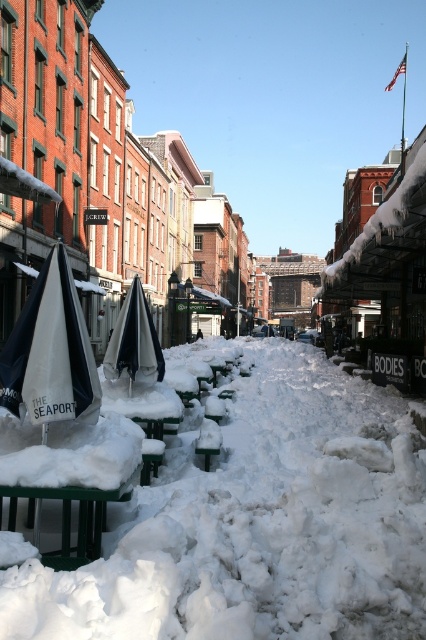
Is white fluffy snow at center taller than white matte umbrella at center?

In fact, white fluffy snow at center may be shorter than white matte umbrella at center.

Which is more to the left, white fluffy snow at center or white matte umbrella at center?

Positioned to the left is white matte umbrella at center.

Between point (270, 449) and point (155, 353), which one is positioned in front?

Point (155, 353) is in front.

You are a GUI agent. You are given a task and a screenshot of the screen. Output one action in this format:
    pyautogui.click(x=<x>, y=<y>)
    Task: Click on the white fluffy snow at center
    The image size is (426, 640).
    Given the screenshot: What is the action you would take?
    pyautogui.click(x=258, y=524)

Does white fluffy snow at center have a smaller size compared to white matte umbrella at left?

Actually, white fluffy snow at center might be larger than white matte umbrella at left.

Is white fluffy snow at center closer to the viewer compared to white matte umbrella at left?

Yes.

What do you see at coordinates (258, 524) in the screenshot? I see `white fluffy snow at center` at bounding box center [258, 524].

You are a GUI agent. You are given a task and a screenshot of the screen. Output one action in this format:
    pyautogui.click(x=<x>, y=<y>)
    Task: Click on the white fluffy snow at center
    The height and width of the screenshot is (640, 426).
    Given the screenshot: What is the action you would take?
    pyautogui.click(x=258, y=524)

Consider the image. Which is below, white matte umbrella at left or white matte umbrella at center?

Positioned lower is white matte umbrella at left.

Measure the distance from white matte umbrella at left to white matte umbrella at center.

A distance of 3.59 meters exists between white matte umbrella at left and white matte umbrella at center.

Where is `white matte umbrella at left`? The height and width of the screenshot is (640, 426). white matte umbrella at left is located at coordinates (51, 353).